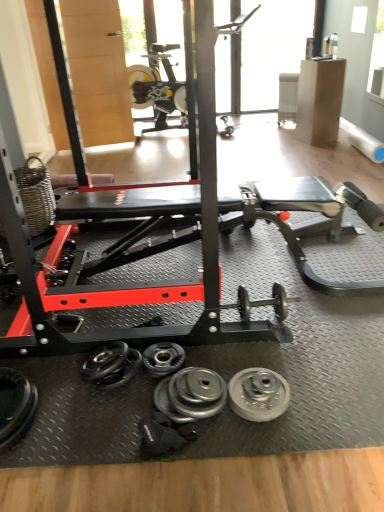
You are a GUI agent. You are given a task and a screenshot of the screen. Output one action in this format:
    pyautogui.click(x=<x>, y=<y>)
    Task: Click on the free location to the left of silver metallic dumbbell at center, which is the first dumbbell from right to left
    This screenshot has height=512, width=384.
    Given the screenshot: What is the action you would take?
    pyautogui.click(x=131, y=413)